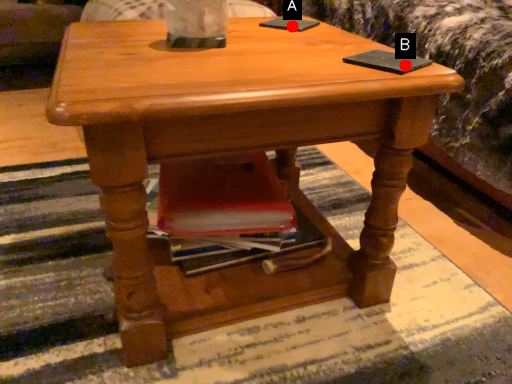
Question: Two points are circled on the image, labeled by A and B beside each circle. Which point is farther from the camera taking this photo?

Choices:
 (A) A is further
 (B) B is further

Answer: (A)